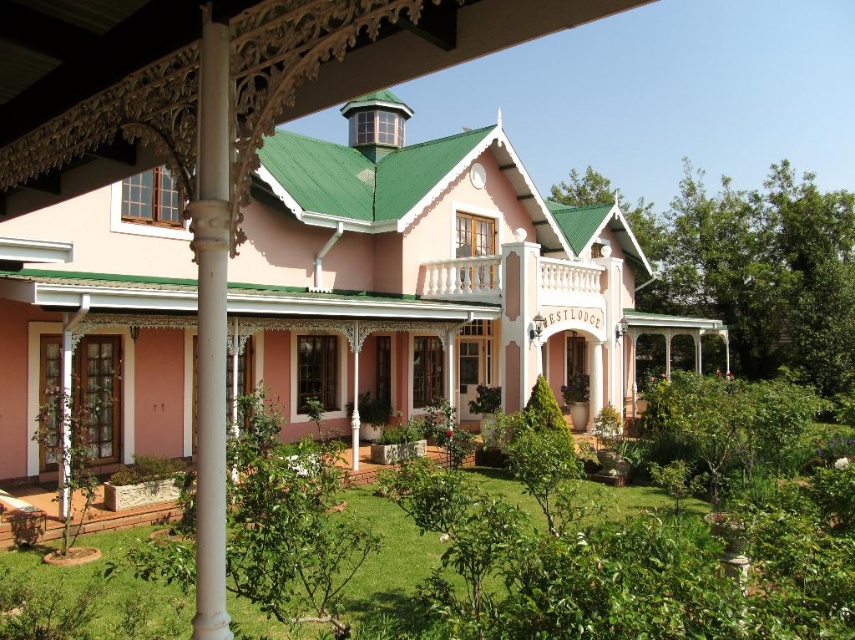
Which is below, green leafy shrubs at center or white carved wood column at center?

green leafy shrubs at center is lower down.

Does green leafy shrubs at center have a lesser height compared to white carved wood column at center?

Correct, green leafy shrubs at center is not as tall as white carved wood column at center.

Between point (568, 484) and point (219, 577), which one is positioned behind?

Point (568, 484)

At what (x,y) coordinates should I click in order to perform the action: click on green leafy shrubs at center. Please return your answer as a coordinate pair (x, y). Looking at the image, I should click on (622, 557).